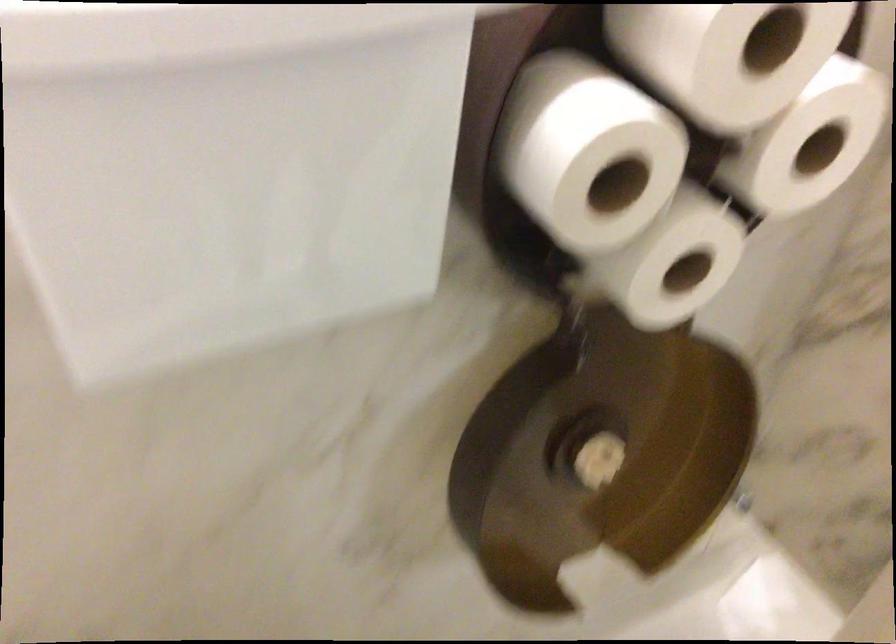
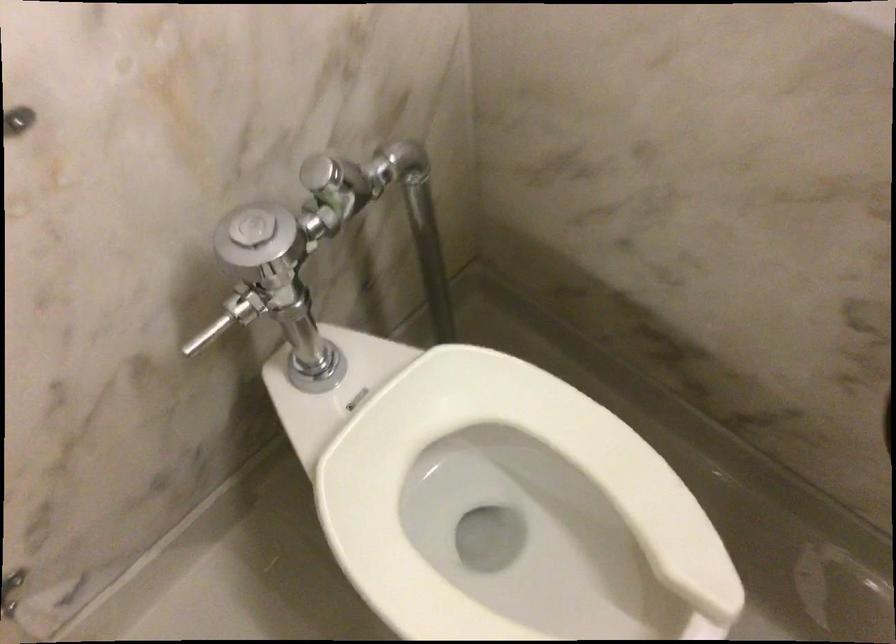
How did the camera likely rotate?

The camera rotated toward left-down.